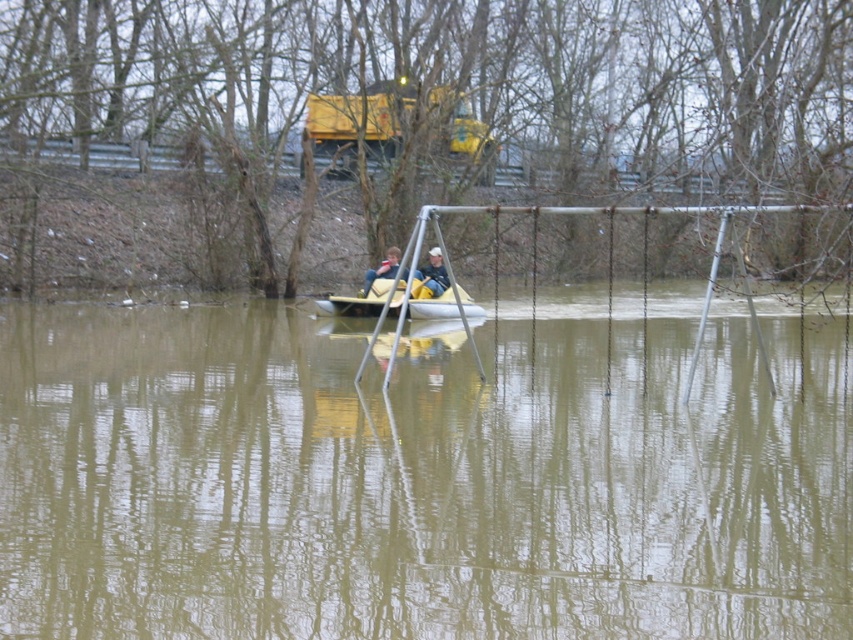
Is brown murky water at center bigger than light blue denim jeans at center?

Correct, brown murky water at center is larger in size than light blue denim jeans at center.

Is point (194, 611) closer to viewer compared to point (436, 260)?

Yes, it is in front of point (436, 260).

In order to click on brown murky water at center in this screenshot , I will do `click(418, 480)`.

Where is `brown murky water at center`? Image resolution: width=853 pixels, height=640 pixels. brown murky water at center is located at coordinates (418, 480).

Between point (601, 492) and point (374, 273), which one is positioned behind?

Positioned behind is point (374, 273).

Find the location of a particular element. Image resolution: width=853 pixels, height=640 pixels. brown murky water at center is located at coordinates (418, 480).

Looking at this image, can you confirm if yellow rubber boat at center is thinner than matte yellow life jacket at center?

No.

Looking at this image, which is more to the right, yellow rubber boat at center or matte yellow life jacket at center?

Positioned to the right is yellow rubber boat at center.

Where is `yellow rubber boat at center`? This screenshot has height=640, width=853. yellow rubber boat at center is located at coordinates (357, 301).